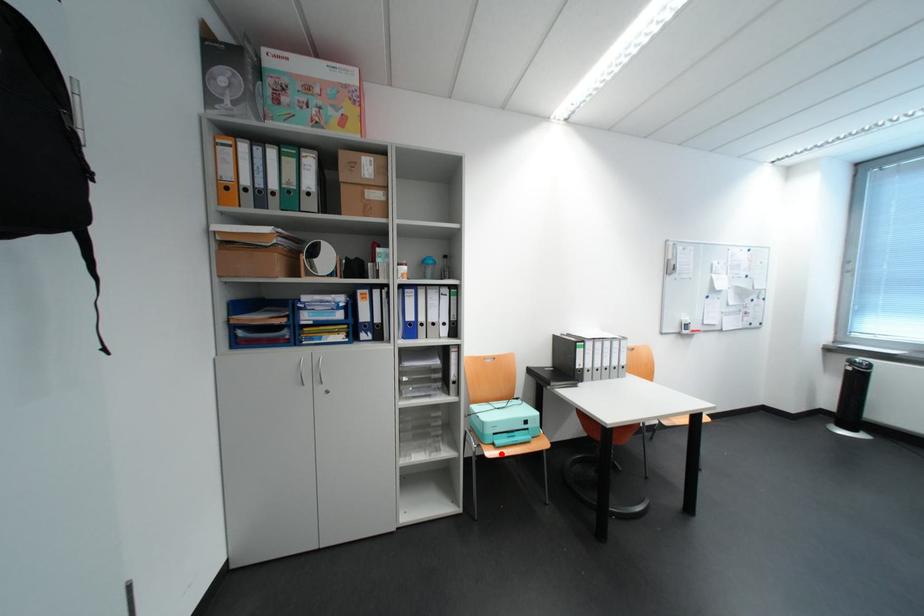
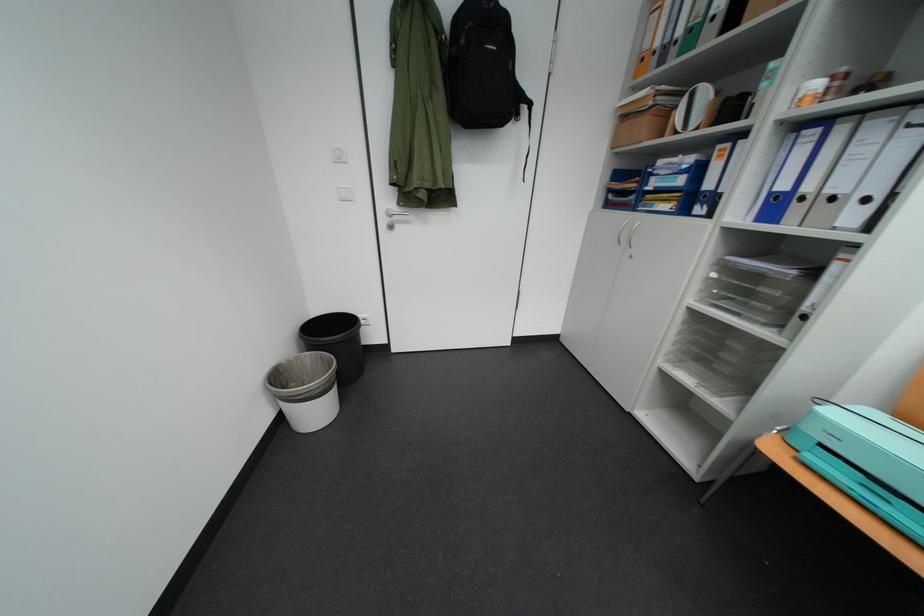
In the second image, find the point that corresponds to the highlighted location in the first image.

(784, 451)